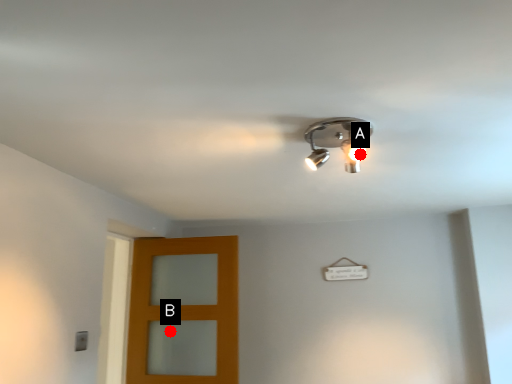
Question: Two points are circled on the image, labeled by A and B beside each circle. Which point is further to the camera?

Choices:
 (A) A is further
 (B) B is further

Answer: (B)